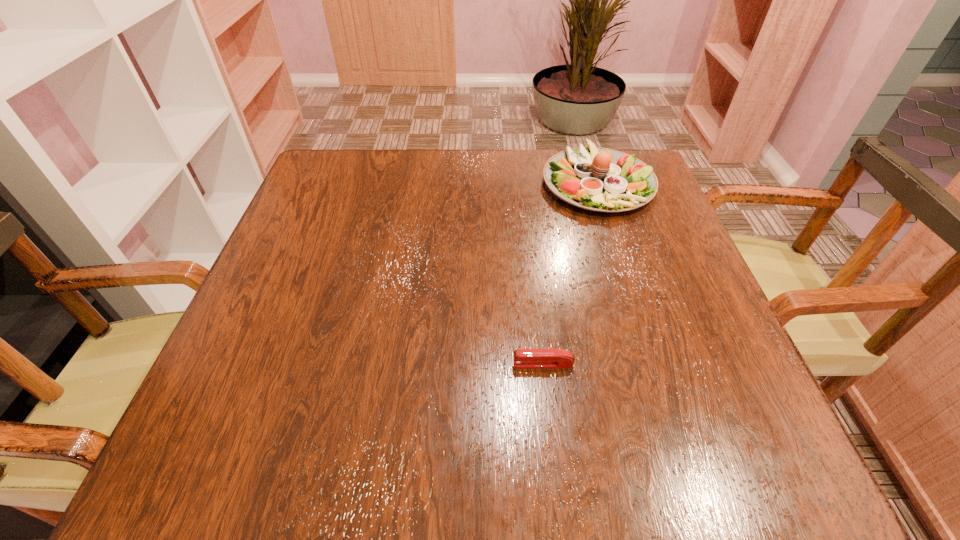
The image size is (960, 540). I want to click on the taller object, so click(599, 179).

At what (x,y) coordinates should I click in order to perform the action: click on the right object. Please return your answer as a coordinate pair (x, y). The image size is (960, 540). Looking at the image, I should click on (599, 179).

Locate an element on the screen. This screenshot has width=960, height=540. the nearer object is located at coordinates (523, 358).

Identify the location of the left object. (523, 358).

The height and width of the screenshot is (540, 960). In order to click on vacant point located on the front of the taller object in this screenshot , I will do `click(635, 298)`.

This screenshot has height=540, width=960. Identify the location of free space located 0.260m on the front-facing side of the shorter object. (353, 364).

I want to click on free space located 0.170m on the front-facing side of the shorter object, so click(x=408, y=364).

At what (x,y) coordinates should I click in order to perform the action: click on vacant space located on the front-facing side of the shorter object. Please return your answer as a coordinate pair (x, y). Image resolution: width=960 pixels, height=540 pixels. Looking at the image, I should click on (359, 364).

In order to click on object present at the far edge in this screenshot , I will do `click(599, 179)`.

Identify the location of object that is at the right edge. The image size is (960, 540). (599, 179).